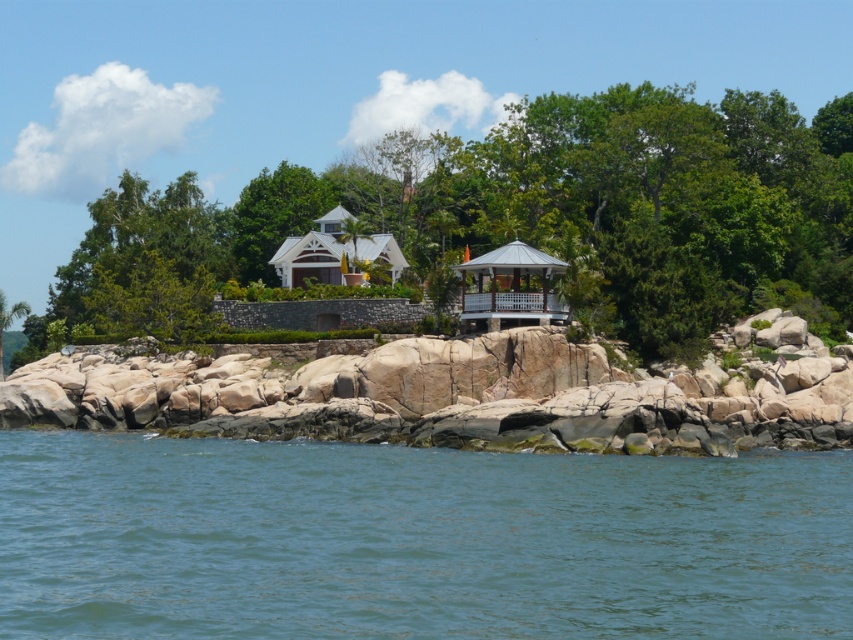
Is point (126, 422) positioned before point (514, 305)?

No.

Does point (219, 422) lie behind point (500, 292)?

No, it is in front of (500, 292).

The height and width of the screenshot is (640, 853). Find the location of `rustic stone rocks at center`. rustic stone rocks at center is located at coordinates (438, 397).

How far apart are blue water at lower center and rustic stone rocks at center?

A distance of 35.08 feet exists between blue water at lower center and rustic stone rocks at center.

Between blue water at lower center and rustic stone rocks at center, which one is positioned lower?

blue water at lower center is lower down.

The width and height of the screenshot is (853, 640). In order to click on blue water at lower center in this screenshot , I will do `click(415, 540)`.

Based on the photo, between blue water at lower center and metallic gazebo at center, which one appears on the left side from the viewer's perspective?

Positioned to the left is blue water at lower center.

Does blue water at lower center have a greater height compared to metallic gazebo at center?

Yes, blue water at lower center is taller than metallic gazebo at center.

The height and width of the screenshot is (640, 853). In order to click on blue water at lower center in this screenshot , I will do (x=415, y=540).

The width and height of the screenshot is (853, 640). What are the coordinates of `blue water at lower center` in the screenshot? It's located at (415, 540).